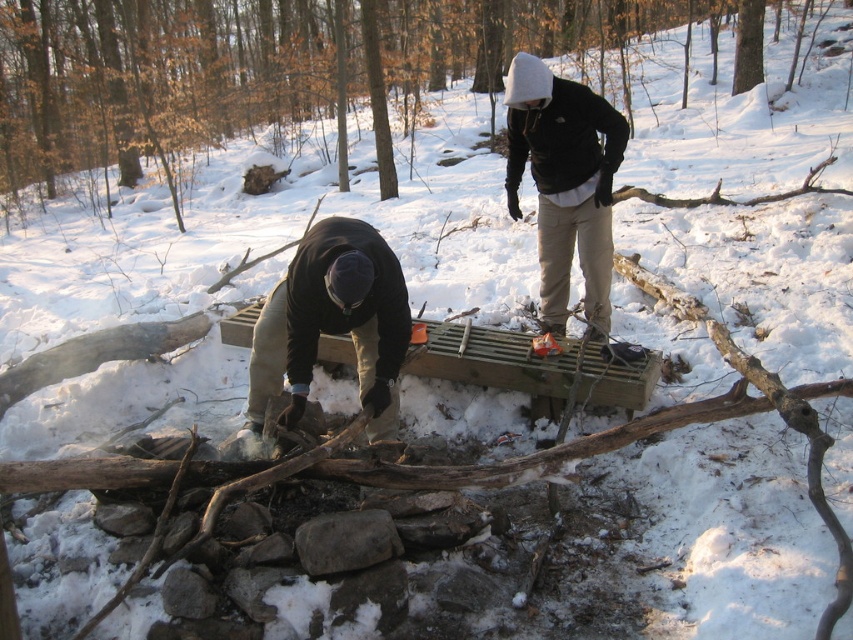
Who is shorter, smooth brown log at center or brown woolen sweater at lower left?

Standing shorter between the two is brown woolen sweater at lower left.

Is smooth brown log at center shorter than brown woolen sweater at lower left?

Incorrect, smooth brown log at center's height does not fall short of brown woolen sweater at lower left's.

This screenshot has width=853, height=640. What are the coordinates of `smooth brown log at center` in the screenshot? It's located at coord(285,67).

Who is lower down, brown woolen sweater at lower left or dark gray fleece jacket at upper center?

Positioned lower is brown woolen sweater at lower left.

Between point (264, 308) and point (561, 177), which one is positioned in front?

Positioned in front is point (264, 308).

Is point (380, 435) farther from camera compared to point (540, 220)?

No, it is not.

Where is `brown woolen sweater at lower left`? brown woolen sweater at lower left is located at coordinates (332, 323).

Is point (352, 88) behind point (579, 221)?

Yes, it is behind point (579, 221).

This screenshot has height=640, width=853. I want to click on smooth brown log at center, so click(x=285, y=67).

Between point (178, 100) and point (550, 179), which one is positioned behind?

Positioned behind is point (178, 100).

This screenshot has width=853, height=640. I want to click on smooth brown log at center, so click(x=285, y=67).